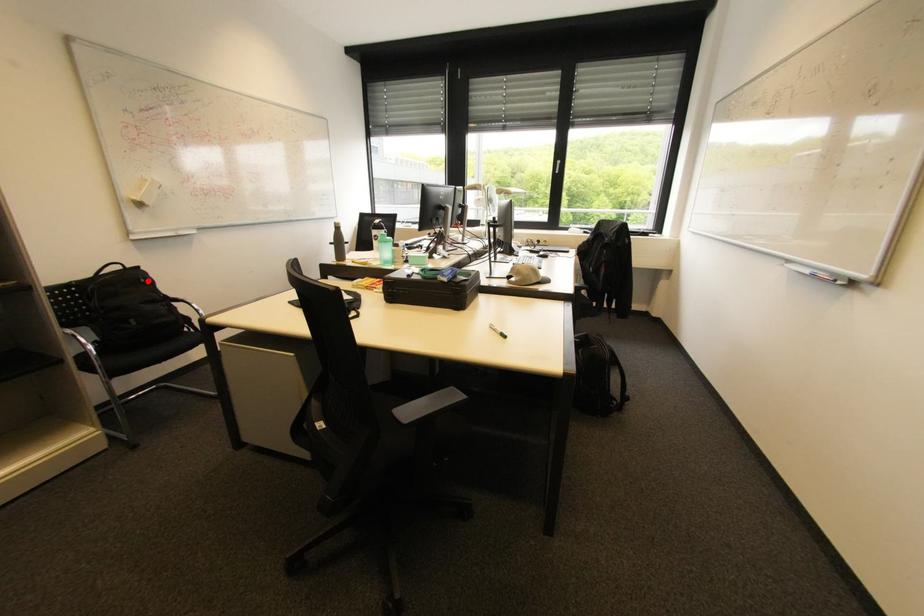
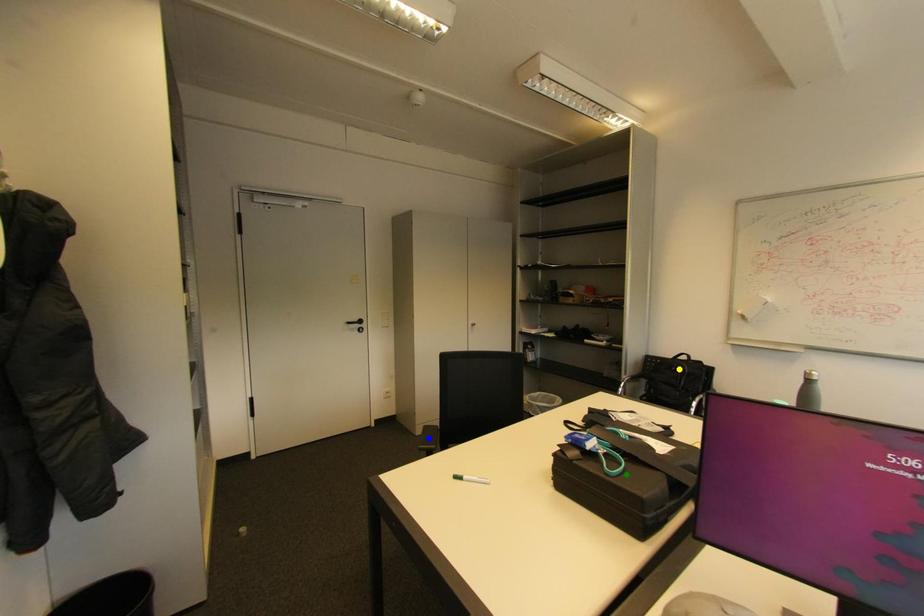
Question: I am providing you with two images of the same scene from different viewpoints. A red point is marked on the first image. You are given multiple points on the second image. Which mark in image 2 goes with the point in image 1?

Choices:
 (A) green point
 (B) yellow point
 (C) blue point

Answer: (B)